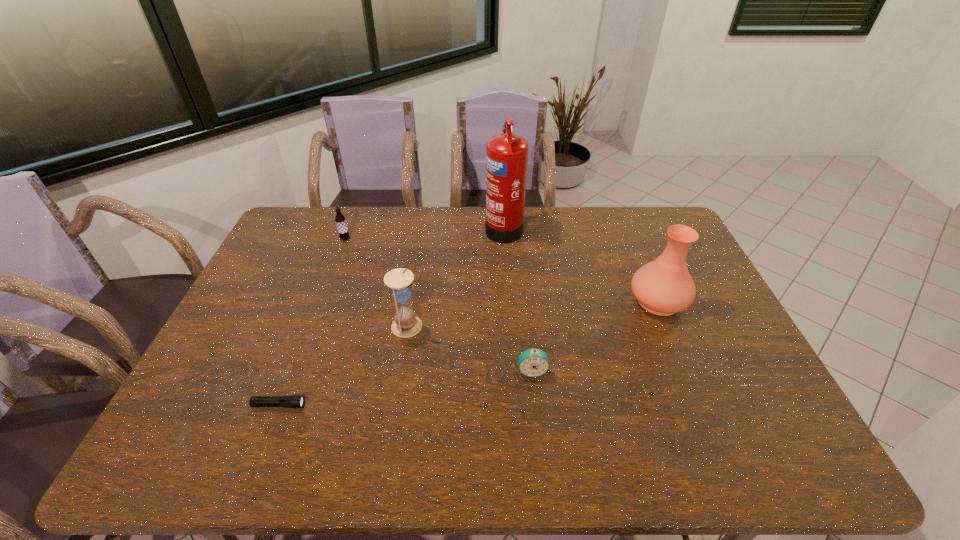
You are a GUI agent. You are given a task and a screenshot of the screen. Output one action in this format:
    pyautogui.click(x=<x>, y=<y>)
    Task: Click on the free space located on the surface of the fire extinguisher
    
    Given the screenshot: What is the action you would take?
    pyautogui.click(x=402, y=227)

The width and height of the screenshot is (960, 540). In order to click on vacant space located 0.070m on the surface of the fire extinguisher in this screenshot , I will do `click(467, 227)`.

Identify the location of vacant point located on the surface of the fire extinguisher. This screenshot has width=960, height=540. (467, 227).

You are a GUI agent. You are given a task and a screenshot of the screen. Output one action in this format:
    pyautogui.click(x=<x>, y=<y>)
    Task: Click on the vacant area situated on the left of the vase
    The height and width of the screenshot is (540, 960).
    Given the screenshot: What is the action you would take?
    pyautogui.click(x=547, y=301)

The height and width of the screenshot is (540, 960). What are the coordinates of `free location located on the back of the third object from left to right` in the screenshot? It's located at (420, 257).

The height and width of the screenshot is (540, 960). Find the location of `vacant area situated 0.100m on the left of the fourth tallest object`. vacant area situated 0.100m on the left of the fourth tallest object is located at coordinates (312, 239).

Identify the location of free location located on the front-facing side of the alarm clock. (540, 441).

Identify the location of free space located at the lens end of the shortest object. This screenshot has height=540, width=960. (446, 405).

In order to click on fire extinguisher located in the far edge section of the desktop in this screenshot , I will do `click(506, 154)`.

Identify the location of root beer that is at the far edge. (340, 219).